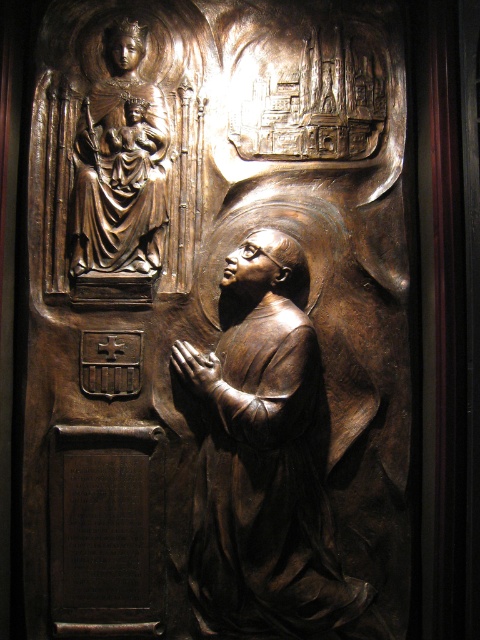
You are an art conservator assessing the spacing between two bronze statues in a gallery. The statues are the bronze statue at center and the bronze statue of madonna and child at upper left. According to the provided information, which statue has a greater width?

The bronze statue at center might be wider than bronze statue of madonna and child at upper left.

You are an art conservator examining the bronze relief sculpture. You need to clean the bronze statue at center and the bronze statue of madonna and child at upper left. Which statue should you clean first if you want to start with the one that is closer to the viewer?

The bronze statue at center is in front of the bronze statue of madonna and child at upper left, so you should clean the bronze statue at center first as it is closer to the viewer.

Based on the scene described, where is the bronze statue at center in relation to the bronze statue of madonna and child at upper left?

The bronze statue at center is located to the right of the bronze statue of madonna and child at upper left.